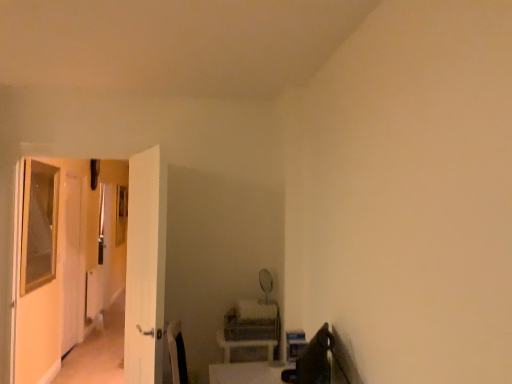
Question: Is point (73, 251) closer or farther from the camera than point (246, 369)?

Choices:
 (A) farther
 (B) closer

Answer: (A)

Question: In the image, is clear glass screen door at left, the 1th screen door positioned from the back, positioned in front of or behind white glossy table at lower center?

Choices:
 (A) front
 (B) behind

Answer: (B)

Question: Considering the real-world distances, which object is farthest from the clear glass screen door at left, positioned as the 2th screen door in right-to-left order?

Choices:
 (A) green fabric swivel chair at lower right
 (B) white glossy table at lower center
 (C) white glossy door at left, which is the second screen door in back-to-front order

Answer: (A)

Question: Which of these objects is positioned closest to the white glossy table at lower center?

Choices:
 (A) clear glass screen door at left, which is the first screen door from left to right
 (B) green fabric swivel chair at lower right
 (C) white glossy door at left, marked as the 2th screen door in a left-to-right arrangement

Answer: (B)